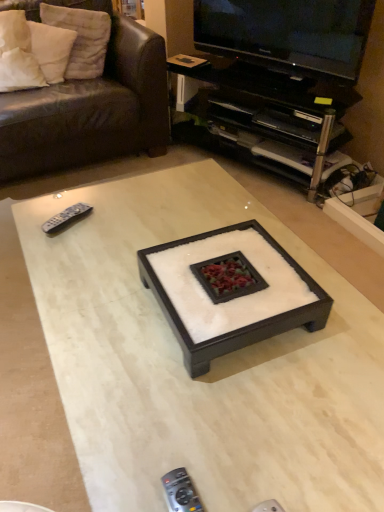
Image resolution: width=384 pixels, height=512 pixels. I want to click on free space to the back side of black plastic remote control at lower center, the 2th remote control from the left, so click(203, 443).